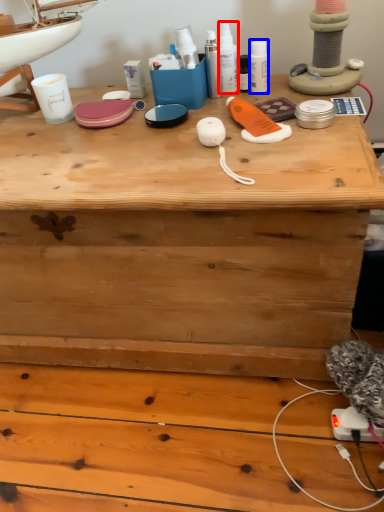
Question: Which point is closer to the camera, toiletry (highlighted by a red box) or toiletry (highlighted by a blue box)?

Choices:
 (A) toiletry
 (B) toiletry

Answer: (A)